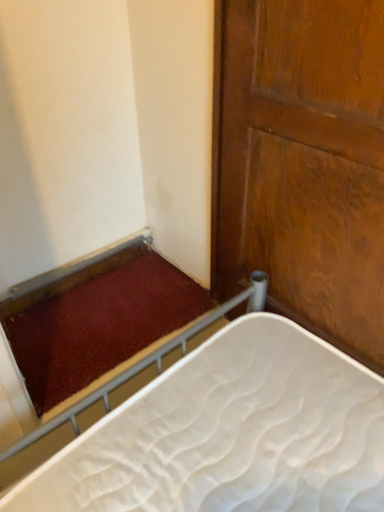
Describe the element at coordinates (302, 163) in the screenshot. I see `wooden door at right` at that location.

Find the location of `wooden door at right`. wooden door at right is located at coordinates (302, 163).

At what (x,y) coordinates should I click in order to perform the action: click on wooden door at right. Please return your answer as a coordinate pair (x, y). This screenshot has height=512, width=384. Looking at the image, I should click on (302, 163).